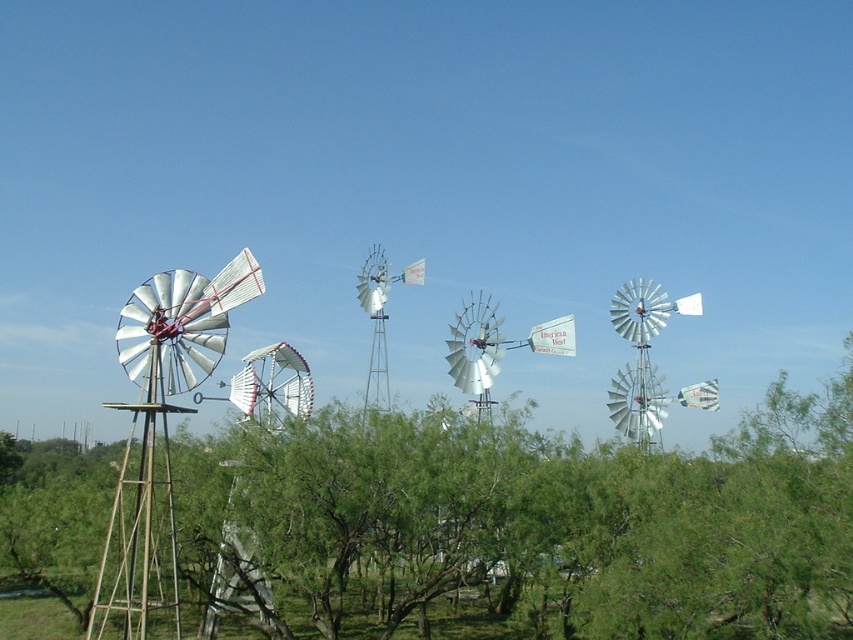
Question: Which object is positioned farthest from the green leafy tree at left?

Choices:
 (A) silver metallic windmill at left
 (B) white metallic windmill at center

Answer: (B)

Question: Does green leafy tree at left appear under silver metallic windmill at left?

Choices:
 (A) yes
 (B) no

Answer: (A)

Question: Considering the real-world distances, which object is farthest from the white metallic windmill at center?

Choices:
 (A) green leafy tree at left
 (B) silver metallic windmill at left

Answer: (B)

Question: Which object appears farthest from the camera in this image?

Choices:
 (A) white metallic windmill at center
 (B) green leafy tree at left
 (C) silver metallic windmill at left

Answer: (A)

Question: Is green leafy tree at left positioned at the back of white metallic windmill at center?

Choices:
 (A) no
 (B) yes

Answer: (A)

Question: Can you confirm if green leafy tree at left is positioned above white metallic windmill at center?

Choices:
 (A) yes
 (B) no

Answer: (B)